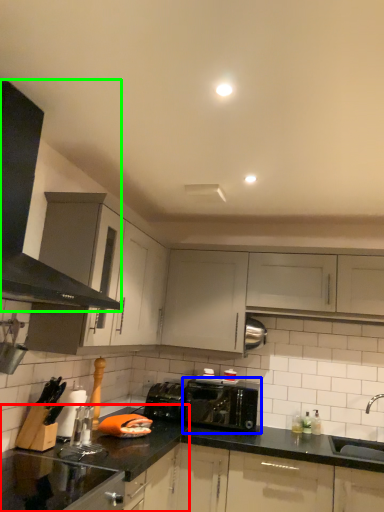
Question: Which object is the farthest from countertop (highlighted by a red box)? Choose among these: toaster (highlighted by a blue box) or exhaust hood (highlighted by a green box).

Choices:
 (A) toaster
 (B) exhaust hood

Answer: (B)